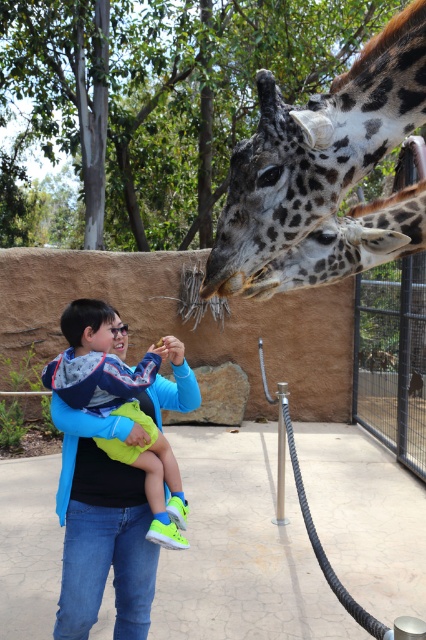
Does light blue denim jacket at center come in front of spotted fur at center?

No, it is behind spotted fur at center.

What do you see at coordinates (118, 406) in the screenshot?
I see `light blue denim jacket at center` at bounding box center [118, 406].

You are a GUI agent. You are given a task and a screenshot of the screen. Output one action in this format:
    pyautogui.click(x=<x>, y=<y>)
    Task: Click on the light blue denim jacket at center
    The width and height of the screenshot is (426, 640).
    Given the screenshot: What is the action you would take?
    pyautogui.click(x=118, y=406)

The width and height of the screenshot is (426, 640). I want to click on light blue denim jacket at center, so click(118, 406).

Is spotted fur giraffe at center wider than light blue denim jacket at center?

Yes, spotted fur giraffe at center is wider than light blue denim jacket at center.

Who is more distant from viewer, [319,100] or [109,445]?

The point [109,445] is behind.

The image size is (426, 640). Describe the element at coordinates (324, 173) in the screenshot. I see `spotted fur giraffe at center` at that location.

The height and width of the screenshot is (640, 426). Identify the location of spotted fur giraffe at center. (324, 173).

Who is positioned more to the right, spotted fur giraffe at center or spotted fur at center?

From the viewer's perspective, spotted fur at center appears more on the right side.

Who is more distant from viewer, (339,172) or (322,228)?

Positioned behind is point (322,228).

You are a GUI agent. You are given a task and a screenshot of the screen. Output one action in this format:
    pyautogui.click(x=<x>, y=<y>)
    Task: Click on the spotted fur giraffe at center
    The image size is (426, 640).
    Given the screenshot: What is the action you would take?
    pyautogui.click(x=324, y=173)